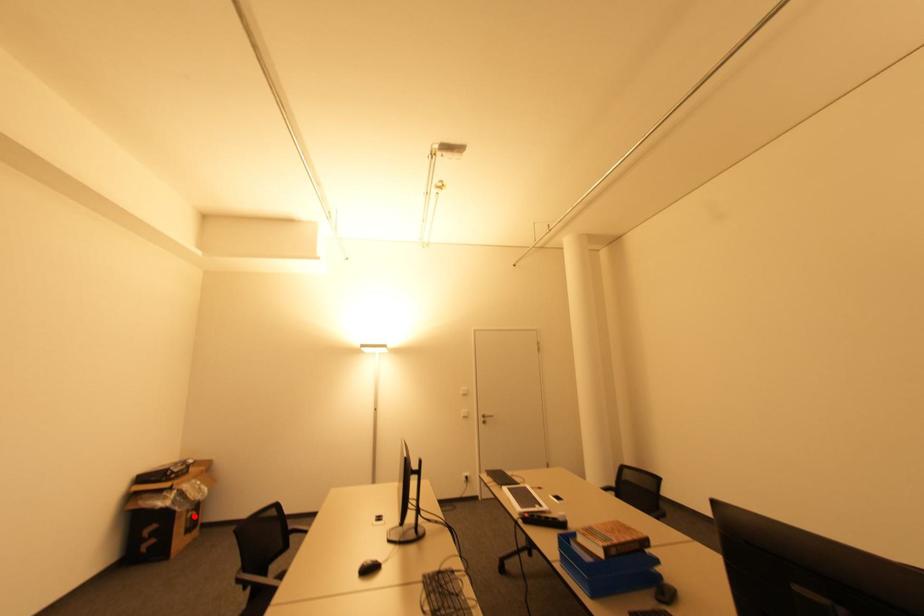
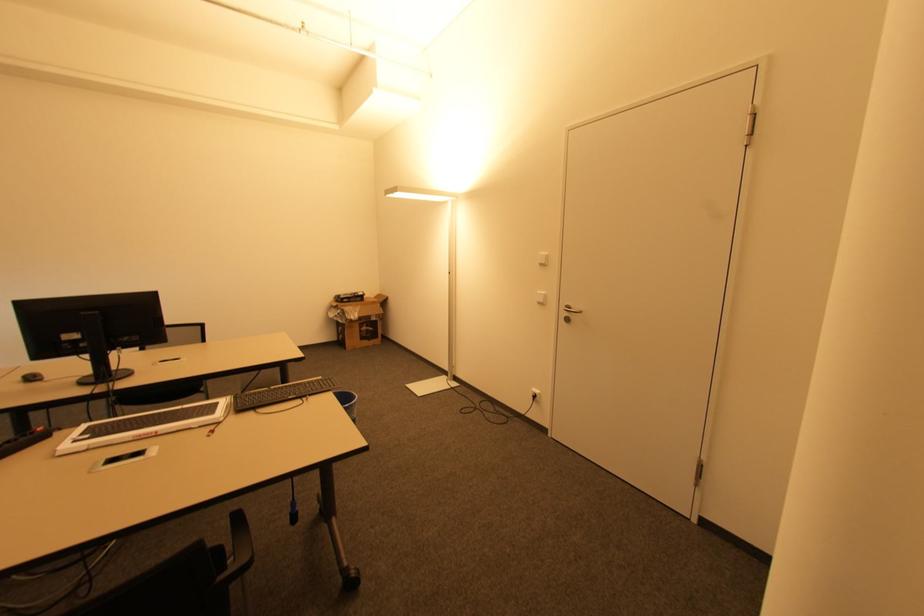
Find the pixel in the second image that matches the highlighted location in the first image.

(369, 331)